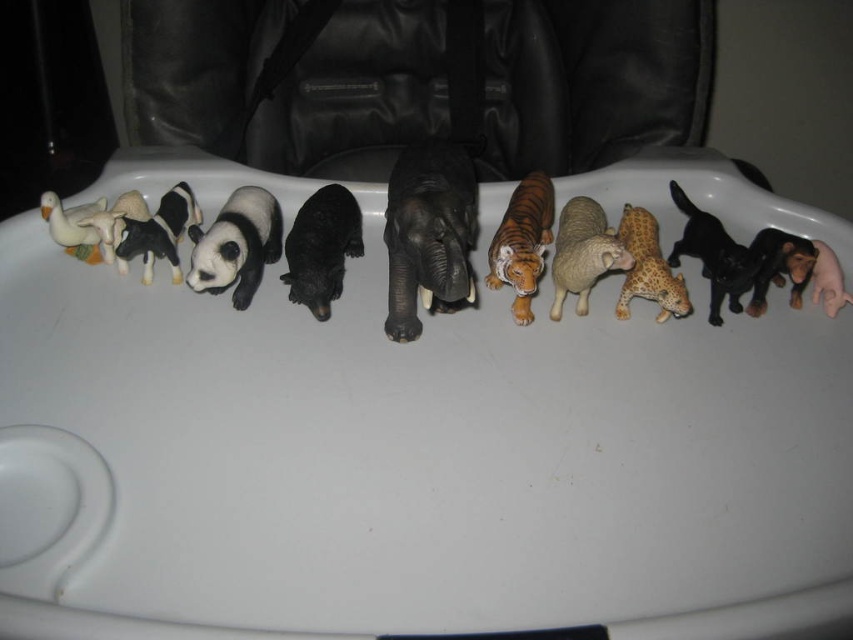
You are a parent trying to organize your child toys. You have a small storage box that can only fit items up to 10 cm in height. You see the black matte panda at center and the orange matte tiger at center. Which toy can fit into the storage box?

The black matte panda at center is shorter than the orange matte tiger at center. Since the storage box can only hold items up to 10 cm, the panda might fit if its height is under 10 cm, but we need more information about their exact heights to be certain.

You are a child sitting in a high chair and want to grab the orange matte tiger at center and the white matte duck at left. Which toy is closer to your right hand?

The orange matte tiger at center is to the right of the white matte duck at left, so the orange matte tiger at center is closer to your right hand.

You are a parent trying to organize your child toys. You have a black matte panda at center and a white matte duck at left. Which toy is positioned lower on the tray?

The black matte panda at center is located below the white matte duck at left, so the panda is positioned lower on the tray.